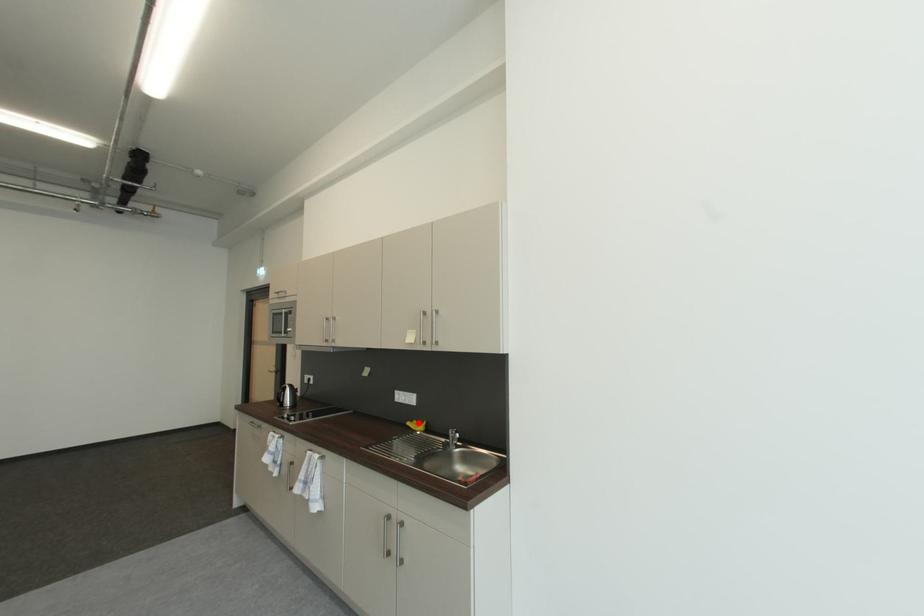
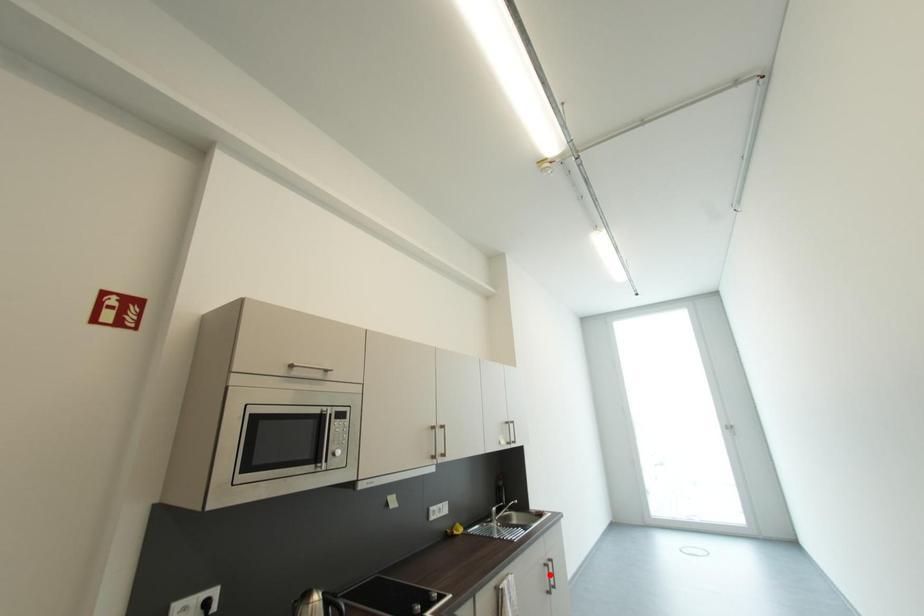
I am providing you with two images of the same scene from different viewpoints. A red point is marked on the first image and another point is marked on the second image. Do the highlighted points in image1 and image2 indicate the same real-world spot?

No